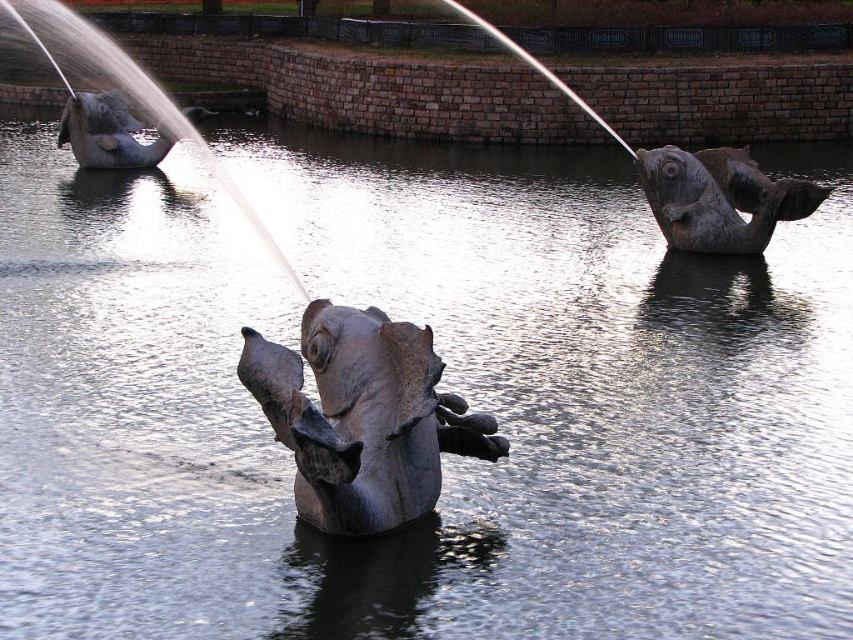
Is matte gray elephant at center bigger than rusty metal fish at right?

Incorrect, matte gray elephant at center is not larger than rusty metal fish at right.

Can you confirm if matte gray elephant at center is smaller than rusty metal fish at right?

Yes, matte gray elephant at center is smaller than rusty metal fish at right.

Find the location of `matte gray elephant at center`. matte gray elephant at center is located at coordinates [363, 417].

You are a GUI agent. You are given a task and a screenshot of the screen. Output one action in this format:
    pyautogui.click(x=<x>, y=<y>)
    Task: Click on the matte gray elephant at center
    This screenshot has height=640, width=853.
    Given the screenshot: What is the action you would take?
    pyautogui.click(x=363, y=417)

Between matte gray elephant at center and gray stone elephant at left, which one appears on the left side from the viewer's perspective?

From the viewer's perspective, gray stone elephant at left appears more on the left side.

Is matte gray elephant at center below gray stone elephant at left?

Yes, matte gray elephant at center is below gray stone elephant at left.

You are a GUI agent. You are given a task and a screenshot of the screen. Output one action in this format:
    pyautogui.click(x=<x>, y=<y>)
    Task: Click on the matte gray elephant at center
    
    Given the screenshot: What is the action you would take?
    pyautogui.click(x=363, y=417)

Locate an element on the screen. This screenshot has width=853, height=640. matte gray elephant at center is located at coordinates (363, 417).

Consider the image. Does rusty metal fish at right have a smaller size compared to gray stone elephant at left?

Yes.

Which is in front, point (672, 211) or point (115, 145)?

Point (672, 211) is more forward.

At what (x,y) coordinates should I click in order to perform the action: click on rusty metal fish at right. Please return your answer as a coordinate pair (x, y). Looking at the image, I should click on (718, 198).